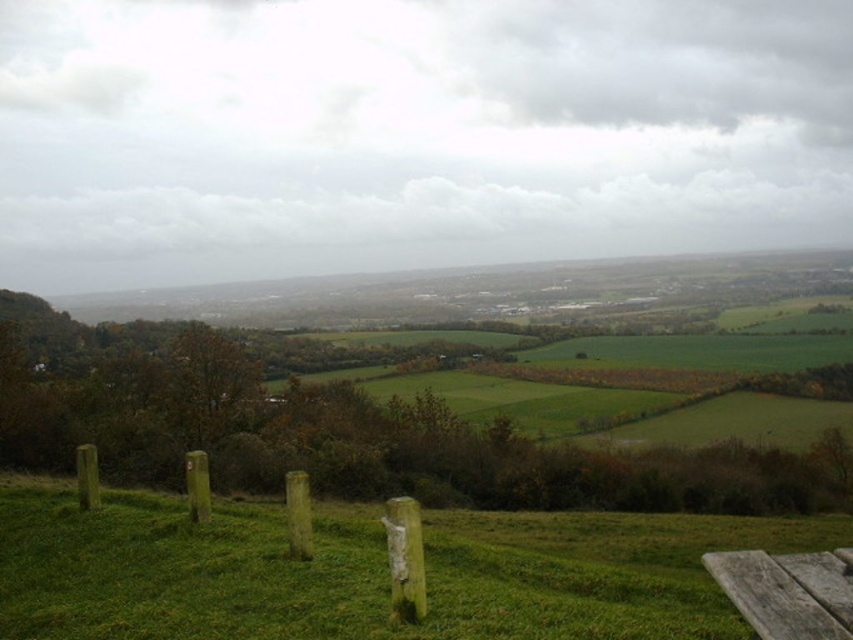
Question: Can you confirm if weathered wood fence at lower center is positioned below weathered wood bench at lower right?

Choices:
 (A) no
 (B) yes

Answer: (B)

Question: Considering the real-world distances, which object is farthest from the green grassy at lower center?

Choices:
 (A) weathered wood bench at lower right
 (B) weathered wood fence at lower center

Answer: (A)

Question: Considering the relative positions of weathered wood fence at lower center and weathered wood bench at lower right in the image provided, where is weathered wood fence at lower center located with respect to weathered wood bench at lower right?

Choices:
 (A) below
 (B) above

Answer: (A)

Question: In this image, where is weathered wood fence at lower center located relative to weathered wood bench at lower right?

Choices:
 (A) below
 (B) above

Answer: (A)

Question: Which point is farther to the camera?

Choices:
 (A) (756, 550)
 (B) (297, 538)

Answer: (A)

Question: Which of the following is the farthest from the observer?

Choices:
 (A) green grassy at lower center
 (B) weathered wood fence at lower center

Answer: (B)